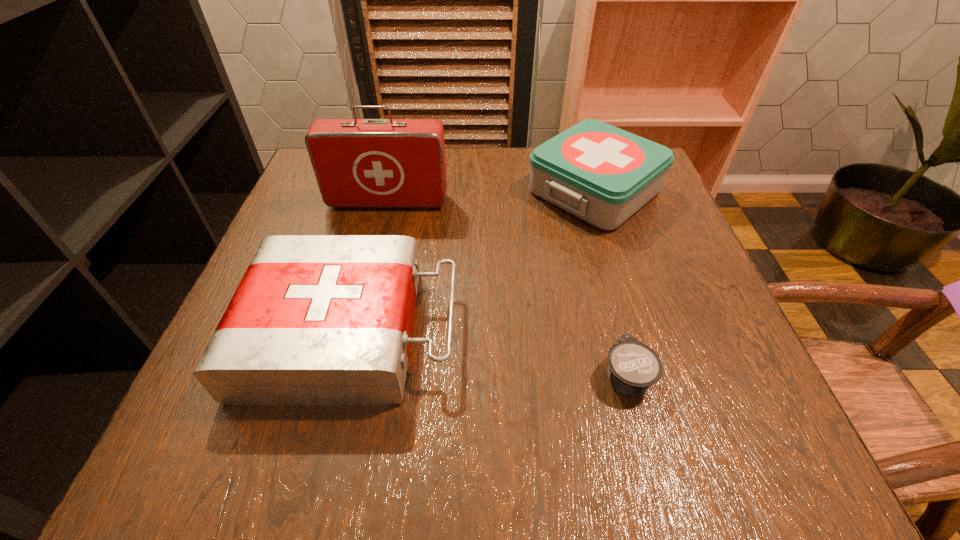
At what (x,y) coordinates should I click in order to perform the action: click on object that is at the far left corner. Please return your answer as a coordinate pair (x, y). Image resolution: width=960 pixels, height=540 pixels. Looking at the image, I should click on (359, 163).

The height and width of the screenshot is (540, 960). I want to click on object that is at the far right corner, so click(602, 174).

What are the coordinates of `free space at the far edge` in the screenshot? It's located at coord(504,169).

Where is `free space at the near edge of the desktop`? free space at the near edge of the desktop is located at coordinates (495, 424).

The image size is (960, 540). In order to click on free space at the right edge in this screenshot , I will do coord(699,288).

At what (x,y) coordinates should I click in order to perform the action: click on vacant area that lies between the nearest first-aid kit and the yogurt. Please return your answer as a coordinate pair (x, y). Looking at the image, I should click on (489, 353).

Identify the location of empty space between the tallest first-aid kit and the rightmost first-aid kit. The width and height of the screenshot is (960, 540). (492, 197).

Locate an element on the screen. vacant area that lies between the tallest object and the yogurt is located at coordinates (507, 289).

At what (x,y) coordinates should I click in order to perform the action: click on free space between the tallest first-aid kit and the shortest object. Please return your answer as a coordinate pair (x, y). Image resolution: width=960 pixels, height=540 pixels. Looking at the image, I should click on (507, 289).

Image resolution: width=960 pixels, height=540 pixels. Find the location of `unoccupied position between the shortest object and the rightmost first-aid kit`. unoccupied position between the shortest object and the rightmost first-aid kit is located at coordinates (611, 284).